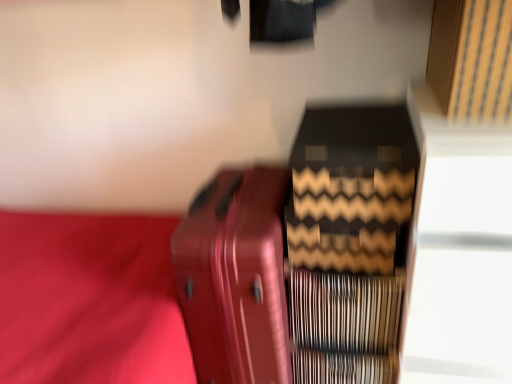
Find the location of a particular element. Image resolution: width=512 pixels, height=384 pixels. glossy plastic suitcase at left is located at coordinates (234, 278).

Image resolution: width=512 pixels, height=384 pixels. Describe the element at coordinates (234, 278) in the screenshot. I see `glossy plastic suitcase at left` at that location.

Image resolution: width=512 pixels, height=384 pixels. Find the location of `glossy plastic suitcase at left`. glossy plastic suitcase at left is located at coordinates tap(234, 278).